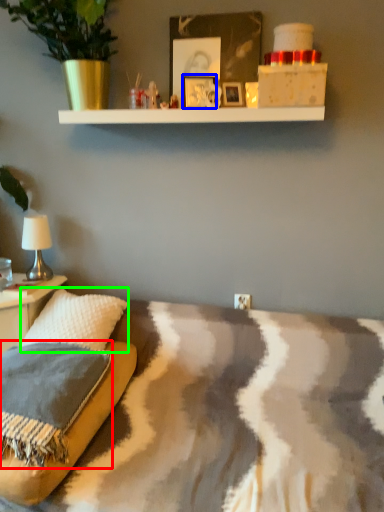
Question: Which object is the closest to the pillow (highlighted by a red box)? Choose among these: picture frame (highlighted by a blue box) or throw pillow (highlighted by a green box).

Choices:
 (A) picture frame
 (B) throw pillow

Answer: (B)